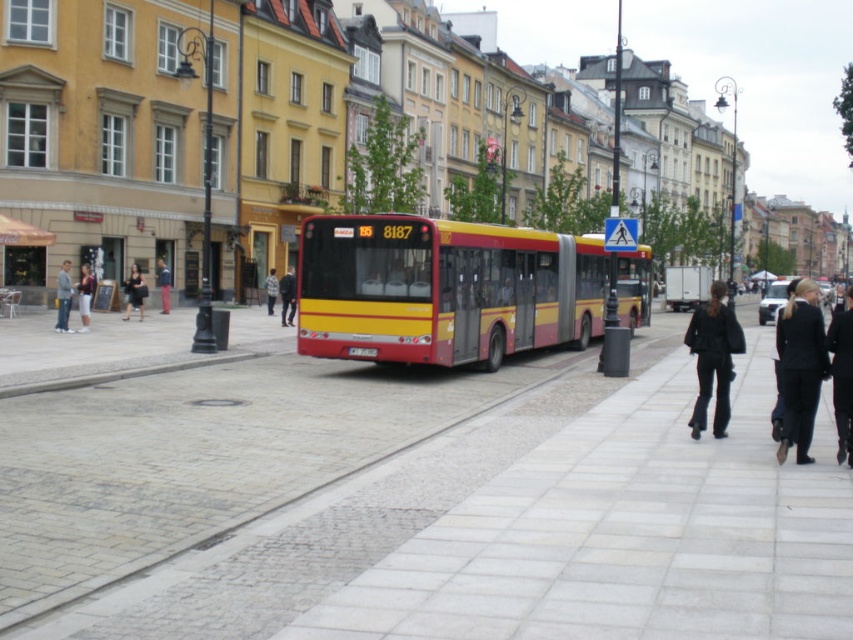
Can you confirm if black fabric coat at right is taller than denim jacket at left?

In fact, black fabric coat at right may be shorter than denim jacket at left.

Can you confirm if black fabric coat at right is smaller than denim jacket at left?

Actually, black fabric coat at right might be larger than denim jacket at left.

I want to click on black fabric coat at right, so click(799, 368).

Does black fabric bag at left have a lesser width compared to dark gray fabric jacket at center?

Correct, black fabric bag at left's width is less than dark gray fabric jacket at center's.

Between point (131, 298) and point (292, 314), which one is positioned in front?

Point (131, 298) is in front.

Between point (128, 284) and point (294, 292), which one is positioned in front?

Point (128, 284) is more forward.

Locate an element on the screen. This screenshot has width=853, height=640. black fabric bag at left is located at coordinates (135, 292).

Is point (16, 234) less distant than point (140, 273)?

Yes, it is in front of point (140, 273).

Is metallic silver bus stop at left shorter than black fabric bag at left?

Correct, metallic silver bus stop at left is not as tall as black fabric bag at left.

Locate an element on the screen. metallic silver bus stop at left is located at coordinates (22, 234).

What are the coordinates of `metallic silver bus stop at left` in the screenshot? It's located at (22, 234).